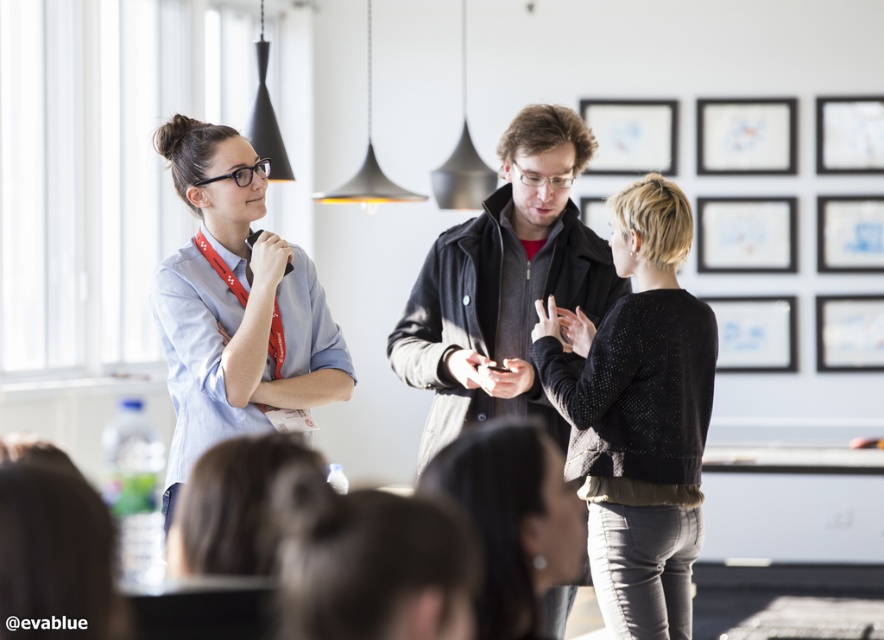
Question: Can you confirm if light blue shirt at center is positioned above matte black jacket at center?

Choices:
 (A) no
 (B) yes

Answer: (B)

Question: Does black textured sweater at center have a lesser width compared to light blue shirt at center?

Choices:
 (A) no
 (B) yes

Answer: (B)

Question: Can you confirm if dark gray jacket at center is thinner than matte black jacket at center?

Choices:
 (A) no
 (B) yes

Answer: (A)

Question: Which of the following is the farthest from the observer?

Choices:
 (A) light blue shirt at center
 (B) dark gray jacket at center

Answer: (B)

Question: Which of the following is the farthest from the observer?

Choices:
 (A) black textured sweater at center
 (B) dark gray jacket at center

Answer: (B)

Question: Which point is farther to the camera?

Choices:
 (A) black textured sweater at center
 (B) dark gray jacket at center
 (C) matte black jacket at center
 (D) light blue shirt at center

Answer: (B)